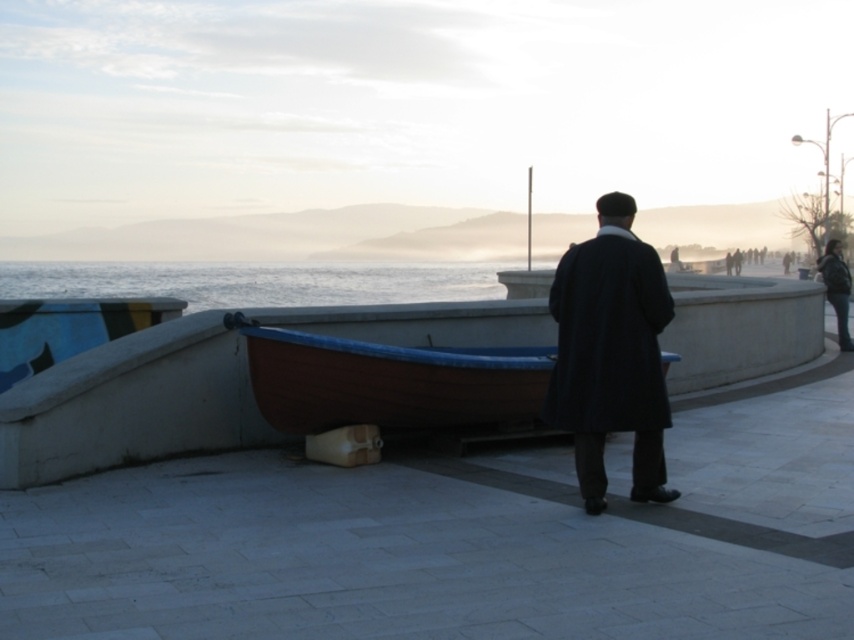
You are standing at the point marked as point (390,381) in the image. What object is located exactly at that point?

The point (390,381) corresponds to the wooden canoe at center.